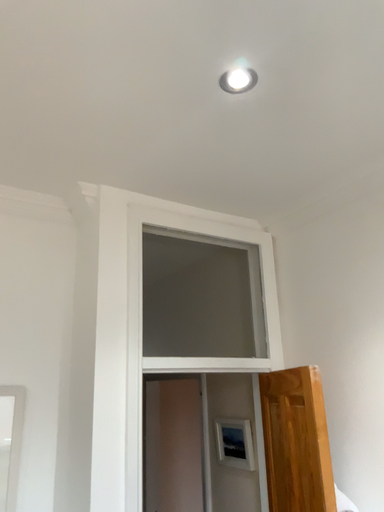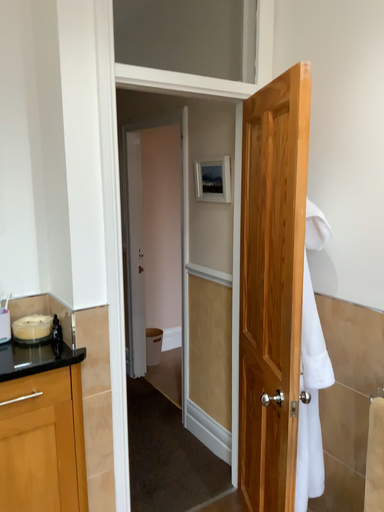
Question: How did the camera likely rotate when shooting the video?

Choices:
 (A) rotated upward
 (B) rotated downward

Answer: (B)